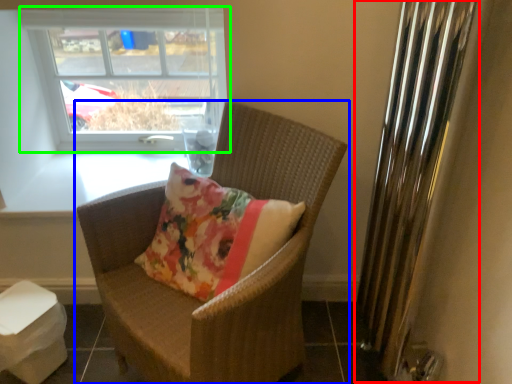
Question: Considering the real-world distances, which object is closest to radiator (highlighted by a red box)? chair (highlighted by a blue box) or window (highlighted by a green box).

Choices:
 (A) chair
 (B) window

Answer: (A)